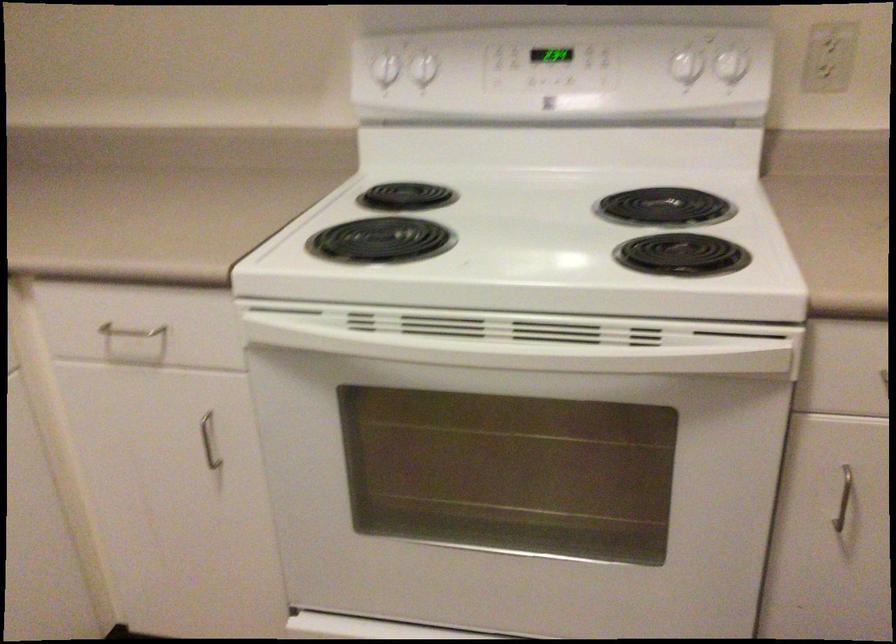
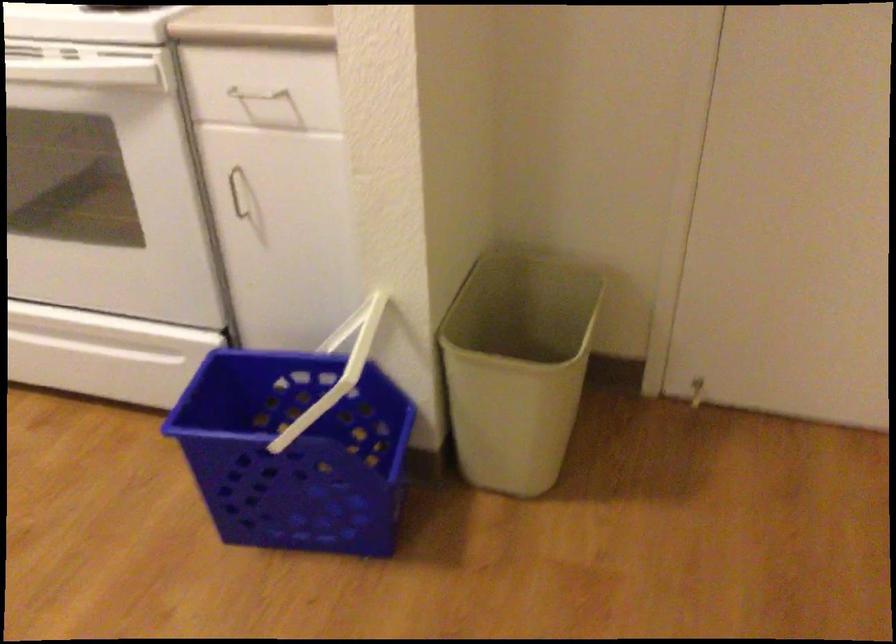
The images are taken continuously from a first-person perspective. In which direction are you moving?

The movement direction of the cameraman is right, backward.